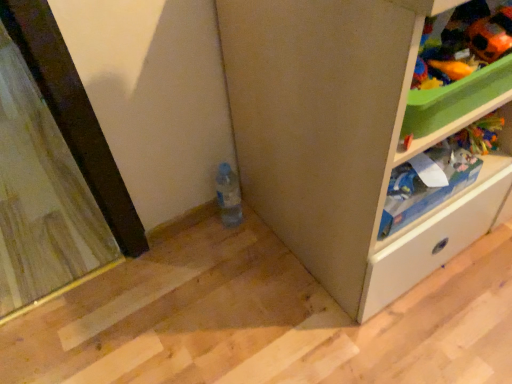
I want to click on vacant space situated on the left part of orange fabric toy at upper right, the 2th toy in the left-to-right sequence, so click(x=446, y=50).